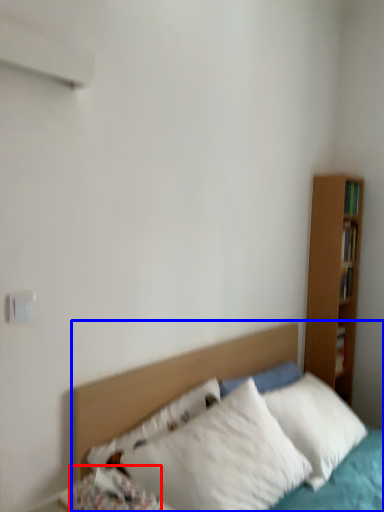
Question: Which point is closer to the camera, pillow (highlighted by a red box) or bed (highlighted by a blue box)?

Choices:
 (A) pillow
 (B) bed

Answer: (A)